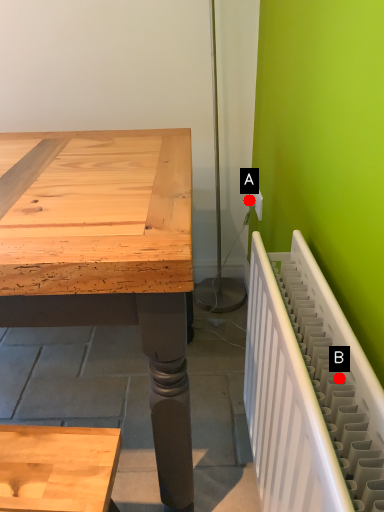
Question: Two points are circled on the image, labeled by A and B beside each circle. Which of the following is the closest to the observer?

Choices:
 (A) A is closer
 (B) B is closer

Answer: (B)